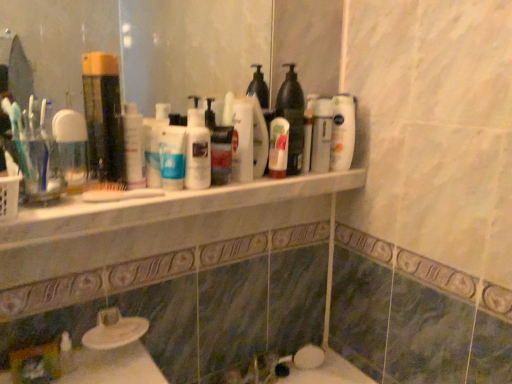
Identify the location of free point in front of white glossy lotion at center, the first cleaning product positioned from the left. (93, 209).